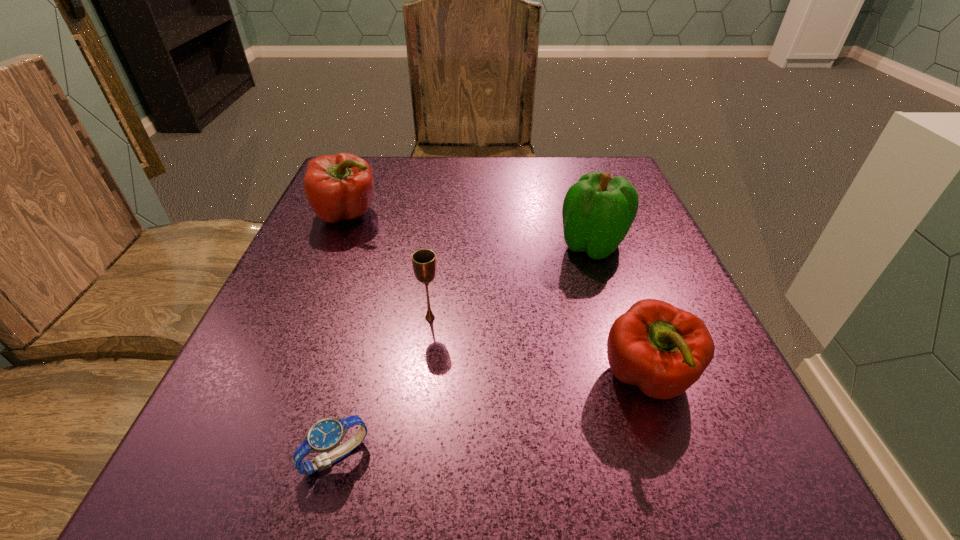
Locate an element on the screen. This screenshot has height=540, width=960. object present at the far edge is located at coordinates (339, 187).

At what (x,y) coordinates should I click in order to perform the action: click on object located in the near edge section of the desktop. Please return your answer as a coordinate pair (x, y). This screenshot has width=960, height=540. Looking at the image, I should click on (325, 435).

Locate an element on the screen. bell pepper that is positioned at the left edge is located at coordinates (339, 187).

Find the location of a particular element. The width and height of the screenshot is (960, 540). watch located in the left edge section of the desktop is located at coordinates (325, 435).

Image resolution: width=960 pixels, height=540 pixels. What are the coordinates of `object situated at the far left corner` in the screenshot? It's located at (339, 187).

At what (x,y) coordinates should I click in order to perform the action: click on object situated at the near left corner. Please return your answer as a coordinate pair (x, y). The image size is (960, 540). Looking at the image, I should click on (325, 435).

The width and height of the screenshot is (960, 540). I want to click on free space at the far edge of the desktop, so pyautogui.click(x=444, y=178).

I want to click on vacant space at the near edge, so click(x=364, y=475).

Where is `vacant region at the left edge of the desktop`? The width and height of the screenshot is (960, 540). vacant region at the left edge of the desktop is located at coordinates (368, 210).

The height and width of the screenshot is (540, 960). I want to click on vacant space at the right edge of the desktop, so coord(729,407).